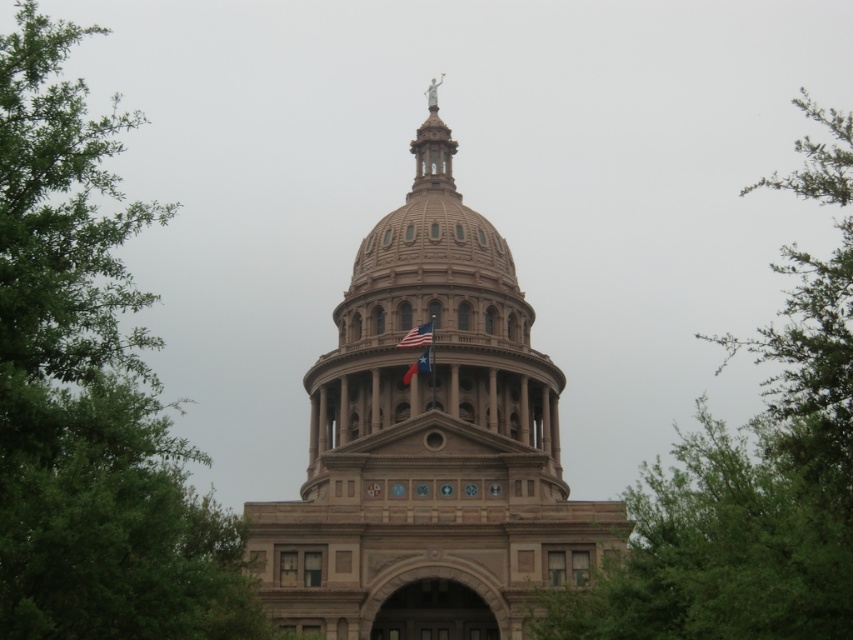
You are standing at a point 47.48 meters away from the point marked as point (13, 333) in the image. If you want to take a photo of the dome and the statue on top of it, which direction should you face?

You should face the direction of point (13, 333) because it is the location where the dome and statue are situated, and standing 47.48 meters away from that point allows for a clear view of the structure.